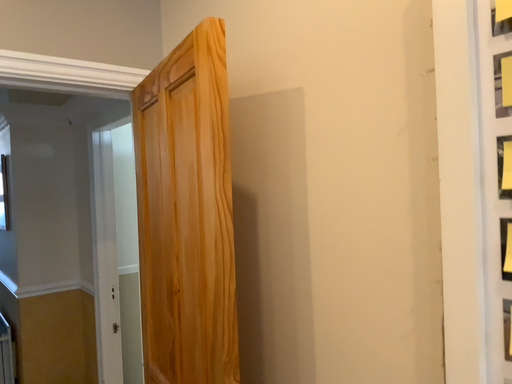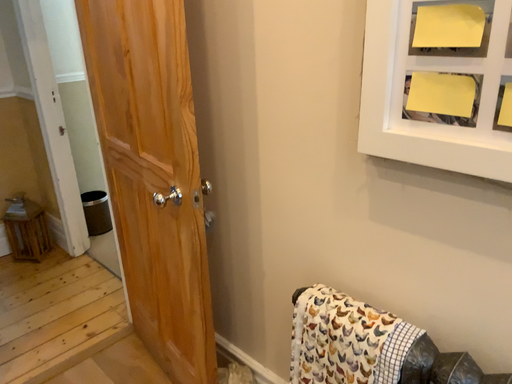
Question: How did the camera likely rotate when shooting the video?

Choices:
 (A) rotated downward
 (B) rotated upward

Answer: (A)